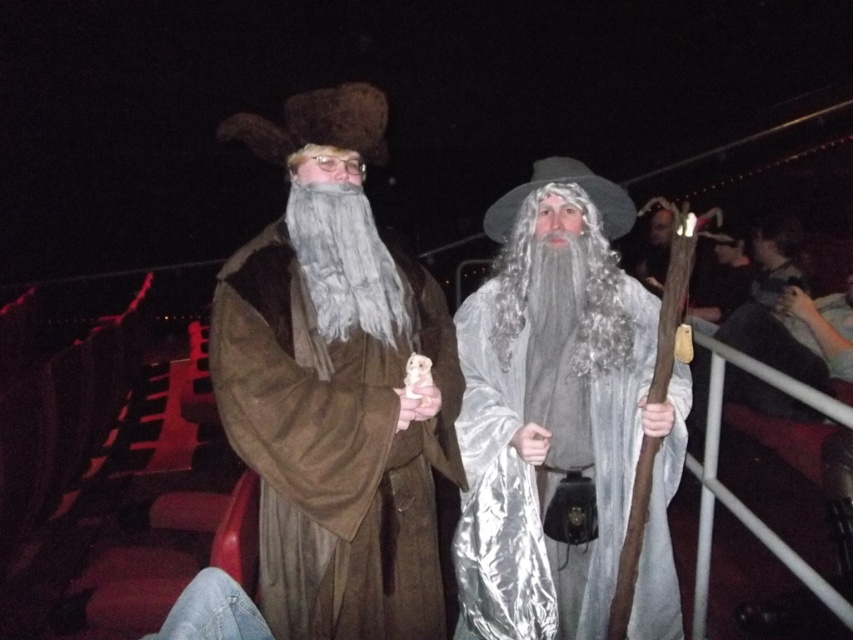
Between silver satin robe at center and gray/curly hair at center, which one is positioned higher?

gray/curly hair at center is higher up.

This screenshot has width=853, height=640. What do you see at coordinates (561, 419) in the screenshot? I see `silver satin robe at center` at bounding box center [561, 419].

What are the coordinates of `silver satin robe at center` in the screenshot? It's located at (561, 419).

Where is `silver satin robe at center`? silver satin robe at center is located at coordinates (561, 419).

Which is more to the right, brown suede hat at upper left or silver satin robe at center?

From the viewer's perspective, silver satin robe at center appears more on the right side.

Is point (412, 298) positioned after point (612, 561)?

No, (412, 298) is closer to viewer.

Locate an element on the screen. The width and height of the screenshot is (853, 640). brown suede hat at upper left is located at coordinates (335, 387).

Is gray fuzzy beard at center to the left of gray/curly hair at center from the viewer's perspective?

Indeed, gray fuzzy beard at center is positioned on the left side of gray/curly hair at center.

Is point (376, 244) farther from camera compared to point (618, 269)?

No, (376, 244) is closer to viewer.

Where is `gray fuzzy beard at center`? Image resolution: width=853 pixels, height=640 pixels. gray fuzzy beard at center is located at coordinates (345, 262).